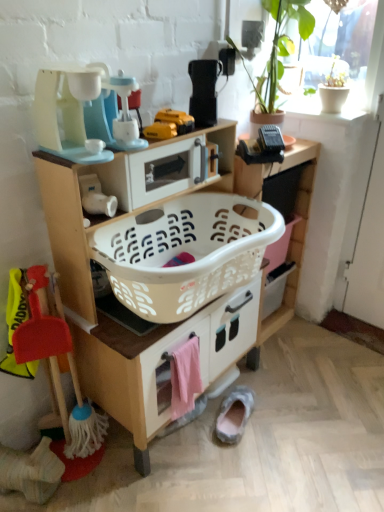
Describe the element at coordinates (161, 288) in the screenshot. I see `white plastic laundry basket at center` at that location.

What do you see at coordinates (183, 375) in the screenshot?
I see `pink fabric towel at lower center` at bounding box center [183, 375].

Where is `white matte pot at upper right`? The image size is (384, 512). white matte pot at upper right is located at coordinates (325, 71).

Locate an element on the screen. This screenshot has height=512, width=384. yellow plastic toy at center, which ranks as the 3th toy in left-to-right order is located at coordinates (169, 124).

What are the coordinates of `the 1st appliance behind the white plastic laundry basket at center, counting from the anchor's position` in the screenshot? It's located at (158, 170).

Considering the relative positions of white plastic laundry basket at center and white plastic microwave at upper center, the second appliance when ordered from left to right, in the image provided, is white plastic laundry basket at center to the right of white plastic microwave at upper center, the second appliance when ordered from left to right, from the viewer's perspective?

Yes.

Between white plastic laundry basket at center and white plastic microwave at upper center, marked as the 2th appliance in a right-to-left arrangement, which one has smaller size?

white plastic microwave at upper center, marked as the 2th appliance in a right-to-left arrangement.

Between point (250, 276) and point (118, 192), which one is positioned in front?

The point (118, 192) is in front.

Considering the sizes of red plastic broom at lower left, the third toy viewed from the right, and pink fabric towel at lower center in the image, is red plastic broom at lower left, the third toy viewed from the right, taller or shorter than pink fabric towel at lower center?

In the image, red plastic broom at lower left, the third toy viewed from the right, appears to be taller than pink fabric towel at lower center.

From the image's perspective, is red plastic broom at lower left, which is the first toy from left to right, beneath pink fabric towel at lower center?

Incorrect, from the image's perspective, red plastic broom at lower left, which is the first toy from left to right, is higher than pink fabric towel at lower center.

Can you tell me how much red plastic broom at lower left, which appears as the 1th toy when ordered from the bottom, and pink fabric towel at lower center differ in facing direction?

0.000105 degrees separate the facing orientations of red plastic broom at lower left, which appears as the 1th toy when ordered from the bottom, and pink fabric towel at lower center.

Is there a large distance between red plastic broom at lower left, the third toy viewed from the right, and pink fabric towel at lower center?

No, red plastic broom at lower left, the third toy viewed from the right, is not far away from pink fabric towel at lower center.

Based on the photo, from a real-world perspective, is black plastic toaster at upper center, acting as the 3th appliance starting from the left, positioned under matte plastic toy coffee maker at upper left, the third appliance viewed from the right, based on gravity?

Correct, in the physical world, black plastic toaster at upper center, acting as the 3th appliance starting from the left, is lower than matte plastic toy coffee maker at upper left, the third appliance viewed from the right.

From the image's perspective, which one is positioned higher, black plastic toaster at upper center, acting as the 3th appliance starting from the left, or matte plastic toy coffee maker at upper left, the third appliance viewed from the right?

From the image's view, black plastic toaster at upper center, acting as the 3th appliance starting from the left, is above.

Can you confirm if black plastic toaster at upper center, acting as the 3th appliance starting from the left, is wider than matte plastic toy coffee maker at upper left, the third appliance viewed from the right?

No, black plastic toaster at upper center, acting as the 3th appliance starting from the left, is not wider than matte plastic toy coffee maker at upper left, the third appliance viewed from the right.

Is point (211, 106) closer to camera compared to point (127, 150)?

No.

Is white plastic laundry basket at center a part of black plastic toaster at upper center, acting as the 3th appliance starting from the left?

No, white plastic laundry basket at center is not surrounded by black plastic toaster at upper center, acting as the 3th appliance starting from the left.

Is black plastic toaster at upper center, acting as the 3th appliance starting from the left, behind white plastic laundry basket at center?

Yes, black plastic toaster at upper center, acting as the 3th appliance starting from the left, is behind white plastic laundry basket at center.

In terms of size, does black plastic toaster at upper center, the 1th appliance when ordered from right to left, appear bigger or smaller than white plastic laundry basket at center?

black plastic toaster at upper center, the 1th appliance when ordered from right to left, is smaller than white plastic laundry basket at center.

Considering the sizes of objects yellow plastic toy at center, the 3th toy when ordered from bottom to top, and white matte vase at center-left, placed as the 2th toy when sorted from bottom to top, in the image provided, who is thinner, yellow plastic toy at center, the 3th toy when ordered from bottom to top, or white matte vase at center-left, placed as the 2th toy when sorted from bottom to top,?

With smaller width is white matte vase at center-left, placed as the 2th toy when sorted from bottom to top.

Is yellow plastic toy at center, the first toy in the top-to-bottom sequence, shorter than white matte vase at center-left, placed as the 2th toy when sorted from top to bottom?

Yes, yellow plastic toy at center, the first toy in the top-to-bottom sequence, is shorter than white matte vase at center-left, placed as the 2th toy when sorted from top to bottom.

From the image's perspective, does yellow plastic toy at center, the 3th toy when ordered from bottom to top, appear lower than white matte vase at center-left, acting as the 2th toy starting from the left?

No.

Who is taller, red plastic broom at lower left, the third toy from the top, or white plastic laundry basket at center?

With more height is red plastic broom at lower left, the third toy from the top.

From the image's perspective, between red plastic broom at lower left, which appears as the 1th toy when ordered from the bottom, and white plastic laundry basket at center, who is located below?

From the image's view, red plastic broom at lower left, which appears as the 1th toy when ordered from the bottom, is below.

Is red plastic broom at lower left, the third toy from the top, facing towards white plastic laundry basket at center?

No, red plastic broom at lower left, the third toy from the top, does not turn towards white plastic laundry basket at center.

The width and height of the screenshot is (384, 512). In the image, there is a white plastic laundry basket at center. Find the location of `toy below it (from a real-world perspective)`. toy below it (from a real-world perspective) is located at coordinates (56, 362).

Considering the relative sizes of white plastic laundry basket at center and black plastic toaster at upper center, acting as the 3th appliance starting from the left, in the image provided, is white plastic laundry basket at center taller than black plastic toaster at upper center, acting as the 3th appliance starting from the left,?

Correct, white plastic laundry basket at center is much taller as black plastic toaster at upper center, acting as the 3th appliance starting from the left.

Is white plastic laundry basket at center located outside black plastic toaster at upper center, the 1th appliance when ordered from right to left?

Yes.

Is the depth of white plastic laundry basket at center less than that of black plastic toaster at upper center, acting as the 3th appliance starting from the left?

Yes.

Where is `the 1st appliance to the left of the white plastic laundry basket at center, starting your count from the anchor`? The width and height of the screenshot is (384, 512). the 1st appliance to the left of the white plastic laundry basket at center, starting your count from the anchor is located at coordinates (158, 170).

Where is `the 1st toy above when counting from the pink fabric towel at lower center (from the image's perspective)`? the 1st toy above when counting from the pink fabric towel at lower center (from the image's perspective) is located at coordinates (56, 362).

Looking at the image, which one is located further to pink fabric towel at lower center, gray suede slipper at lower center or white matte pot at upper right?

white matte pot at upper right lies further to pink fabric towel at lower center than the other object.

Consider the image. Looking at the image, which one is located further to black plastic toaster at upper center, the 1th appliance when ordered from right to left, pink fabric towel at lower center or gray suede slipper at lower center?

Based on the image, gray suede slipper at lower center appears to be further to black plastic toaster at upper center, the 1th appliance when ordered from right to left.

Based on their spatial positions, is white matte pot at upper right or white plastic laundry basket at center closer to yellow plastic toy at center, which ranks as the 3th toy in left-to-right order?

white plastic laundry basket at center.

Based on their spatial positions, is white plastic microwave at upper center, marked as the 2th appliance in a right-to-left arrangement, or white plastic laundry basket at center further from white matte pot at upper right?

white plastic laundry basket at center is positioned further to the anchor white matte pot at upper right.

Estimate the real-world distances between objects in this image. Which object is further from matte plastic toy coffee maker at upper left, the first appliance viewed from the left, yellow plastic toy at center, which is counted as the first toy, starting from the right, or gray suede slipper at lower center?

gray suede slipper at lower center lies further to matte plastic toy coffee maker at upper left, the first appliance viewed from the left, than the other object.

Looking at the image, which one is located closer to black plastic toaster at upper center, the 1th appliance when ordered from right to left, white plastic laundry basket at center or white plastic laundry basket at center?

The object closer to black plastic toaster at upper center, the 1th appliance when ordered from right to left, is white plastic laundry basket at center.

Estimate the real-world distances between objects in this image. Which object is closer to white plastic laundry basket at center, white matte vase at center-left, acting as the 2th toy starting from the left, or white plastic microwave at upper center, marked as the 2th appliance in a right-to-left arrangement?

The object closer to white plastic laundry basket at center is white plastic microwave at upper center, marked as the 2th appliance in a right-to-left arrangement.

Looking at the image, which one is located further to white matte vase at center-left, the second toy viewed from the right, white plastic laundry basket at center or yellow plastic toy at center, which is counted as the first toy, starting from the right?

white plastic laundry basket at center.

Locate an element on the screen. appliance between matte plastic toy coffee maker at upper left, the third appliance viewed from the right, and gray suede slipper at lower center in the up-down direction is located at coordinates (158, 170).

Locate an element on the screen. basket container between yellow plastic toy at center, which is counted as the first toy, starting from the right, and pink fabric towel at lower center from top to bottom is located at coordinates (185, 252).

You are a GUI agent. You are given a task and a screenshot of the screen. Output one action in this format:
    pyautogui.click(x=<x>, y=<y>)
    Task: Click on the toy between yellow plastic toy at center, which is counted as the first toy, starting from the right, and white plastic laundry basket at center, in the vertical direction
    This screenshot has width=384, height=512.
    Given the screenshot: What is the action you would take?
    pyautogui.click(x=96, y=197)

I want to click on drawer between yellow plastic toy at center, the first toy in the top-to-bottom sequence, and gray suede slipper at lower center vertically, so click(x=183, y=375).